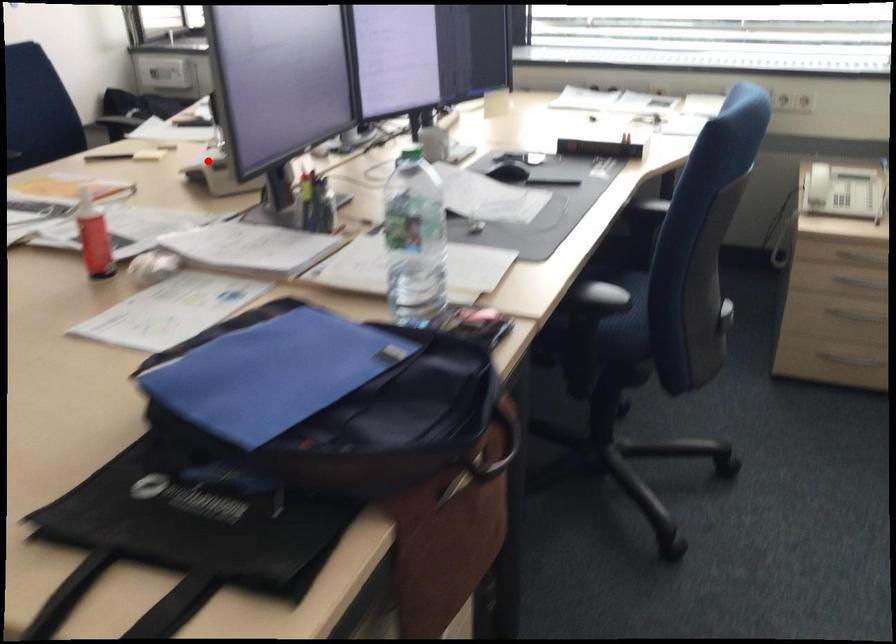
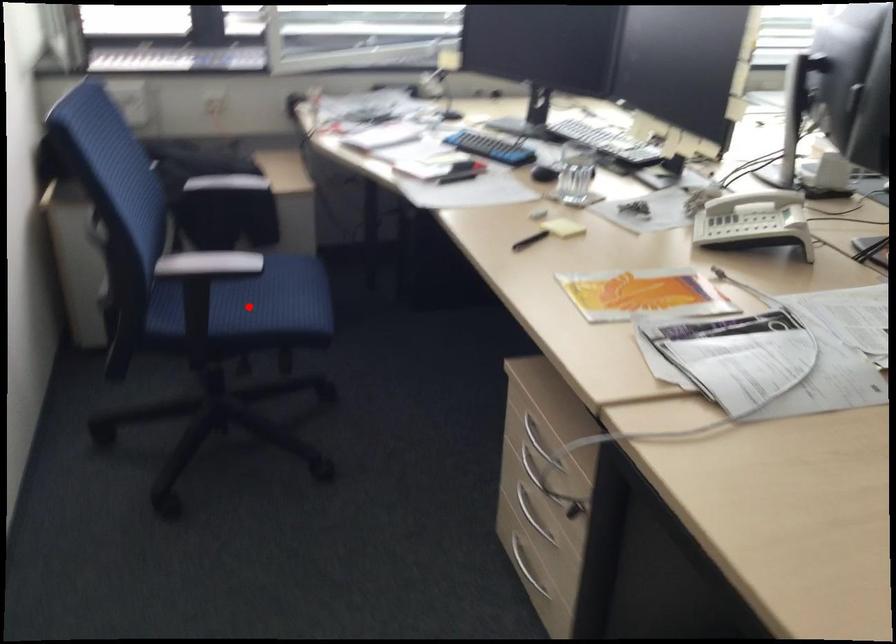
I am providing you with two images of the same scene from different viewpoints. A red point is marked on the first image and another point is marked on the second image. Is the red point in image1 aligned with the point shown in image2?

No